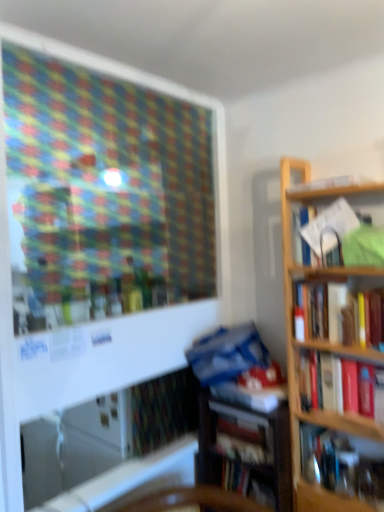
Question: From the image's perspective, would you say white paper at upper right, the 2th book viewed from the top, is shown under blue matte book at center, the 3th book from the bottom?

Choices:
 (A) yes
 (B) no

Answer: (B)

Question: Can you confirm if white paper at upper right, which is counted as the 6th book, starting from the bottom, is thinner than blue matte book at center, the 3th book from the bottom?

Choices:
 (A) no
 (B) yes

Answer: (A)

Question: Does white paper at upper right, the 2th book viewed from the top, have a greater height compared to blue matte book at center, which is the 5th book from top to bottom?

Choices:
 (A) no
 (B) yes

Answer: (B)

Question: From the image's perspective, is white paper at upper right, which is counted as the 6th book, starting from the bottom, on top of blue matte book at center, the 3th book from the bottom?

Choices:
 (A) yes
 (B) no

Answer: (A)

Question: Can you confirm if white paper at upper right, the 2th book viewed from the top, is positioned to the right of blue matte book at center, the 3th book from the bottom?

Choices:
 (A) no
 (B) yes

Answer: (B)

Question: From the image's perspective, is hardcover book at right, the 4th book when ordered from bottom to top, located above or below white paper at upper right, which is counted as the 6th book, starting from the bottom?

Choices:
 (A) above
 (B) below

Answer: (B)

Question: In terms of width, does hardcover book at right, the 4th book when ordered from bottom to top, look wider or thinner when compared to white paper at upper right, which is counted as the 6th book, starting from the bottom?

Choices:
 (A) thin
 (B) wide

Answer: (A)

Question: Is hardcover book at right, positioned as the fourth book in top-to-bottom order, bigger or smaller than white paper at upper right, the 2th book viewed from the top?

Choices:
 (A) small
 (B) big

Answer: (B)

Question: From a real-world perspective, relative to white paper at upper right, which is counted as the 6th book, starting from the bottom, is hardcover book at right, positioned as the fourth book in top-to-bottom order, vertically above or below?

Choices:
 (A) above
 (B) below

Answer: (B)

Question: Is hardcover book at right, the 4th book when ordered from bottom to top, bigger or smaller than hardcover book at right, positioned as the 3th book in top-to-bottom order?

Choices:
 (A) big
 (B) small

Answer: (A)

Question: Choose the correct answer: Is hardcover book at right, positioned as the fourth book in top-to-bottom order, inside hardcover book at right, positioned as the 3th book in top-to-bottom order, or outside it?

Choices:
 (A) inside
 (B) outside

Answer: (B)

Question: From a real-world perspective, is hardcover book at right, positioned as the fourth book in top-to-bottom order, physically located above or below hardcover book at right, positioned as the 3th book in top-to-bottom order?

Choices:
 (A) below
 (B) above

Answer: (A)

Question: Looking at their shapes, would you say hardcover book at right, positioned as the fourth book in top-to-bottom order, is wider or thinner than hardcover book at right, positioned as the 3th book in top-to-bottom order?

Choices:
 (A) wide
 (B) thin

Answer: (A)

Question: In terms of width, does white paper at upper right, which is counted as the 6th book, starting from the bottom, look wider or thinner when compared to hardcover book at upper right, which appears as the 1th book when viewed from the top?

Choices:
 (A) thin
 (B) wide

Answer: (B)

Question: Is white paper at upper right, the 2th book viewed from the top, to the left or to the right of hardcover book at upper right, which appears as the seventh book when ordered from the bottom, in the image?

Choices:
 (A) left
 (B) right

Answer: (A)